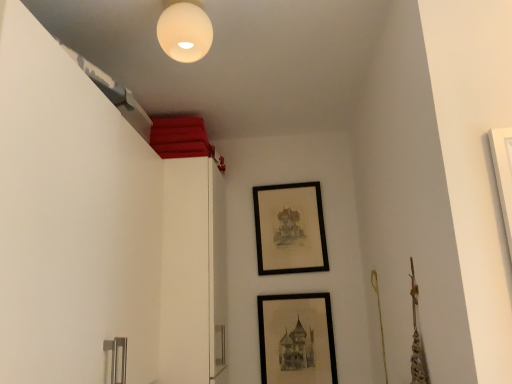
In order to face black matte picture frame at upper center, acting as the 2th picture frame starting from the bottom, should I rotate leftwards or rightwards?

Rotate your view right by about 4.725°.

What do you see at coordinates (184, 30) in the screenshot? The image size is (512, 384). I see `white matte sphere at upper center` at bounding box center [184, 30].

How much space does black matte picture frame at lower center, which appears as the second picture frame when viewed from the top, occupy horizontally?

The width of black matte picture frame at lower center, which appears as the second picture frame when viewed from the top, is 2.23 inches.

Where is `black matte picture frame at upper center, acting as the 2th picture frame starting from the bottom`? The height and width of the screenshot is (384, 512). black matte picture frame at upper center, acting as the 2th picture frame starting from the bottom is located at coordinates (290, 228).

Does white matte sphere at upper center have a smaller size compared to black matte picture frame at lower center, which appears as the second picture frame when viewed from the top?

Indeed, white matte sphere at upper center has a smaller size compared to black matte picture frame at lower center, which appears as the second picture frame when viewed from the top.

Is white matte sphere at upper center facing towards black matte picture frame at lower center, which is the first picture frame in bottom-to-top order?

No, white matte sphere at upper center is not aimed at black matte picture frame at lower center, which is the first picture frame in bottom-to-top order.

In order to click on picture frame that is the 2nd object located below the white matte sphere at upper center (from the image's perspective) in this screenshot , I will do `click(296, 339)`.

Considering the relative positions of white matte sphere at upper center and black matte picture frame at lower center, the first picture frame positioned from the front, in the image provided, is white matte sphere at upper center in front of black matte picture frame at lower center, the first picture frame positioned from the front,?

Yes, the depth of white matte sphere at upper center is less than that of black matte picture frame at lower center, the first picture frame positioned from the front.

From the image's perspective, would you say black matte picture frame at lower center, which appears as the 2th picture frame when viewed from the back, is positioned over black matte picture frame at upper center, marked as the 1th picture frame in a top-to-bottom arrangement?

No, from the image's perspective, black matte picture frame at lower center, which appears as the 2th picture frame when viewed from the back, is not over black matte picture frame at upper center, marked as the 1th picture frame in a top-to-bottom arrangement.

From a real-world perspective, does black matte picture frame at lower center, the first picture frame positioned from the front, stand above black matte picture frame at upper center, which is the first picture frame in back-to-front order?

No, from a real-world perspective, black matte picture frame at lower center, the first picture frame positioned from the front, is not on top of black matte picture frame at upper center, which is the first picture frame in back-to-front order.

Considering the positions of objects black matte picture frame at lower center, which appears as the second picture frame when viewed from the top, and black matte picture frame at upper center, acting as the 2th picture frame starting from the bottom, in the image provided, who is more to the left, black matte picture frame at lower center, which appears as the second picture frame when viewed from the top, or black matte picture frame at upper center, acting as the 2th picture frame starting from the bottom,?

From the viewer's perspective, black matte picture frame at upper center, acting as the 2th picture frame starting from the bottom, appears more on the left side.

Does black matte picture frame at lower center, which appears as the second picture frame when viewed from the top, have a greater height compared to black matte picture frame at upper center, which appears as the second picture frame when viewed from the front?

Incorrect, the height of black matte picture frame at lower center, which appears as the second picture frame when viewed from the top, is not larger of that of black matte picture frame at upper center, which appears as the second picture frame when viewed from the front.

Is black matte picture frame at lower center, which appears as the 2th picture frame when viewed from the back, facing towards white matte sphere at upper center?

No, black matte picture frame at lower center, which appears as the 2th picture frame when viewed from the back, is not oriented towards white matte sphere at upper center.

Considering the sizes of objects black matte picture frame at lower center, which appears as the 2th picture frame when viewed from the back, and white matte sphere at upper center in the image provided, who is smaller, black matte picture frame at lower center, which appears as the 2th picture frame when viewed from the back, or white matte sphere at upper center?

Smaller between the two is white matte sphere at upper center.

Does point (297, 380) come farther from viewer compared to point (195, 2)?

Yes, point (297, 380) is behind point (195, 2).

Considering the sizes of objects white matte sphere at upper center and black matte picture frame at upper center, which is the first picture frame in back-to-front order, in the image provided, who is thinner, white matte sphere at upper center or black matte picture frame at upper center, which is the first picture frame in back-to-front order,?

black matte picture frame at upper center, which is the first picture frame in back-to-front order, is thinner.

Considering the relative sizes of white matte sphere at upper center and black matte picture frame at upper center, which appears as the second picture frame when viewed from the front, in the image provided, is white matte sphere at upper center taller than black matte picture frame at upper center, which appears as the second picture frame when viewed from the front,?

No.

From a real-world perspective, is white matte sphere at upper center positioned above or below black matte picture frame at upper center, acting as the 2th picture frame starting from the bottom?

From a real-world perspective, white matte sphere at upper center is physically above black matte picture frame at upper center, acting as the 2th picture frame starting from the bottom.

Based on the photo, is the position of white matte sphere at upper center more distant than that of black matte picture frame at upper center, acting as the 2th picture frame starting from the bottom?

No, white matte sphere at upper center is closer to the camera.

Can you confirm if black matte picture frame at upper center, marked as the 1th picture frame in a top-to-bottom arrangement, is thinner than black matte picture frame at lower center, which is the first picture frame in bottom-to-top order?

No.

Considering the sizes of black matte picture frame at upper center, which is the first picture frame in back-to-front order, and black matte picture frame at lower center, which appears as the second picture frame when viewed from the top, in the image, is black matte picture frame at upper center, which is the first picture frame in back-to-front order, taller or shorter than black matte picture frame at lower center, which appears as the second picture frame when viewed from the top,?

Clearly, black matte picture frame at upper center, which is the first picture frame in back-to-front order, is taller compared to black matte picture frame at lower center, which appears as the second picture frame when viewed from the top.

In order to click on picture frame on the left of black matte picture frame at lower center, which appears as the second picture frame when viewed from the top in this screenshot , I will do `click(290, 228)`.

Considering their positions, is black matte picture frame at upper center, which appears as the second picture frame when viewed from the front, located in front of or behind black matte picture frame at lower center, which appears as the second picture frame when viewed from the top?

Clearly, black matte picture frame at upper center, which appears as the second picture frame when viewed from the front, is behind black matte picture frame at lower center, which appears as the second picture frame when viewed from the top.

This screenshot has width=512, height=384. Find the location of `light fixture above the black matte picture frame at upper center, which is the first picture frame in back-to-front order (from the image's perspective)`. light fixture above the black matte picture frame at upper center, which is the first picture frame in back-to-front order (from the image's perspective) is located at coordinates (x=184, y=30).

Is black matte picture frame at upper center, which is the first picture frame in back-to-front order, beside white matte sphere at upper center?

No.

Locate an element on the screen. light fixture positioned vertically above the black matte picture frame at lower center, which appears as the second picture frame when viewed from the top (from a real-world perspective) is located at coordinates (184, 30).

Find the location of a particular element. The height and width of the screenshot is (384, 512). picture frame beneath the black matte picture frame at upper center, which appears as the second picture frame when viewed from the front (from a real-world perspective) is located at coordinates (296, 339).

Estimate the real-world distances between objects in this image. Which object is closer to black matte picture frame at upper center, which is the first picture frame in back-to-front order, white matte sphere at upper center or black matte picture frame at lower center, which appears as the 2th picture frame when viewed from the back?

black matte picture frame at lower center, which appears as the 2th picture frame when viewed from the back.

Based on their spatial positions, is black matte picture frame at lower center, which appears as the second picture frame when viewed from the top, or black matte picture frame at upper center, which is the first picture frame in back-to-front order, closer to white matte sphere at upper center?

black matte picture frame at upper center, which is the first picture frame in back-to-front order.

Based on their spatial positions, is white matte sphere at upper center or black matte picture frame at upper center, marked as the 1th picture frame in a top-to-bottom arrangement, closer to black matte picture frame at lower center, which appears as the second picture frame when viewed from the top?

Based on the image, black matte picture frame at upper center, marked as the 1th picture frame in a top-to-bottom arrangement, appears to be nearer to black matte picture frame at lower center, which appears as the second picture frame when viewed from the top.

Which object lies further to the anchor point black matte picture frame at lower center, which is the first picture frame in bottom-to-top order, black matte picture frame at upper center, which is the first picture frame in back-to-front order, or white matte sphere at upper center?

Among the two, white matte sphere at upper center is located further to black matte picture frame at lower center, which is the first picture frame in bottom-to-top order.

From the image, which object appears to be farther from black matte picture frame at upper center, marked as the 1th picture frame in a top-to-bottom arrangement, black matte picture frame at lower center, which is the first picture frame in bottom-to-top order, or white matte sphere at upper center?

The object further to black matte picture frame at upper center, marked as the 1th picture frame in a top-to-bottom arrangement, is white matte sphere at upper center.

Based on the photo, estimate the real-world distances between objects in this image. Which object is closer to white matte sphere at upper center, black matte picture frame at upper center, which is the first picture frame in back-to-front order, or black matte picture frame at lower center, which appears as the 2th picture frame when viewed from the back?

Among the two, black matte picture frame at upper center, which is the first picture frame in back-to-front order, is located nearer to white matte sphere at upper center.

Find the location of a particular element. Image resolution: width=512 pixels, height=384 pixels. picture frame between white matte sphere at upper center and black matte picture frame at lower center, which is the first picture frame in bottom-to-top order, from top to bottom is located at coordinates (290, 228).